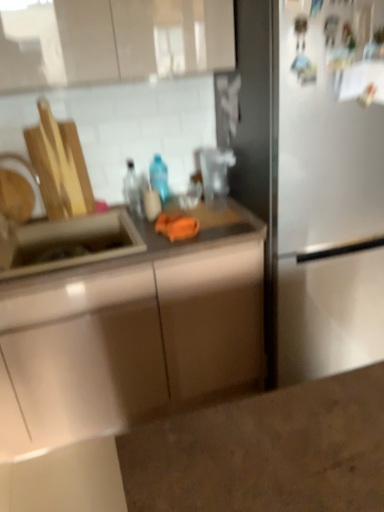
Question: Does matte stainless steel sink at left turn towards translucent plastic bottle at center, marked as the first bottle in a right-to-left arrangement?

Choices:
 (A) no
 (B) yes

Answer: (A)

Question: Considering the relative positions of matte stainless steel sink at left and translucent plastic bottle at center, marked as the first bottle in a right-to-left arrangement, in the image provided, is matte stainless steel sink at left to the left of translucent plastic bottle at center, marked as the first bottle in a right-to-left arrangement, from the viewer's perspective?

Choices:
 (A) yes
 (B) no

Answer: (A)

Question: Can you confirm if matte stainless steel sink at left is wider than translucent plastic bottle at center, marked as the 2th bottle in a left-to-right arrangement?

Choices:
 (A) yes
 (B) no

Answer: (A)

Question: Does matte stainless steel sink at left have a lesser width compared to translucent plastic bottle at center, marked as the 2th bottle in a left-to-right arrangement?

Choices:
 (A) yes
 (B) no

Answer: (B)

Question: Is matte stainless steel sink at left directly adjacent to translucent plastic bottle at center, marked as the 2th bottle in a left-to-right arrangement?

Choices:
 (A) no
 (B) yes

Answer: (A)

Question: In terms of width, does translucent plastic bottle at center, marked as the 2th bottle in a left-to-right arrangement, look wider or thinner when compared to stainless steel sink at left?

Choices:
 (A) wide
 (B) thin

Answer: (B)

Question: Is translucent plastic bottle at center, marked as the first bottle in a right-to-left arrangement, taller or shorter than stainless steel sink at left?

Choices:
 (A) tall
 (B) short

Answer: (B)

Question: Does point (155, 186) appear closer or farther from the camera than point (132, 263)?

Choices:
 (A) closer
 (B) farther

Answer: (B)

Question: In the image, is translucent plastic bottle at center, marked as the first bottle in a right-to-left arrangement, on the left side or the right side of stainless steel sink at left?

Choices:
 (A) left
 (B) right

Answer: (B)

Question: Is translucent plastic bottle at center, marked as the first bottle in a right-to-left arrangement, taller or shorter than brushed metal faucet at left?

Choices:
 (A) short
 (B) tall

Answer: (A)

Question: From the image's perspective, is translucent plastic bottle at center, marked as the first bottle in a right-to-left arrangement, located above or below brushed metal faucet at left?

Choices:
 (A) above
 (B) below

Answer: (A)

Question: Considering the relative positions of translucent plastic bottle at center, marked as the 2th bottle in a left-to-right arrangement, and brushed metal faucet at left in the image provided, is translucent plastic bottle at center, marked as the 2th bottle in a left-to-right arrangement, to the left or to the right of brushed metal faucet at left?

Choices:
 (A) right
 (B) left

Answer: (A)

Question: Looking at the image, does translucent plastic bottle at center, marked as the first bottle in a right-to-left arrangement, seem bigger or smaller compared to brushed metal faucet at left?

Choices:
 (A) small
 (B) big

Answer: (A)

Question: Relative to brushed metal faucet at left, is stainless steel sink at left in front or behind?

Choices:
 (A) behind
 (B) front

Answer: (B)

Question: From a real-world perspective, is stainless steel sink at left positioned above or below brushed metal faucet at left?

Choices:
 (A) above
 (B) below

Answer: (B)